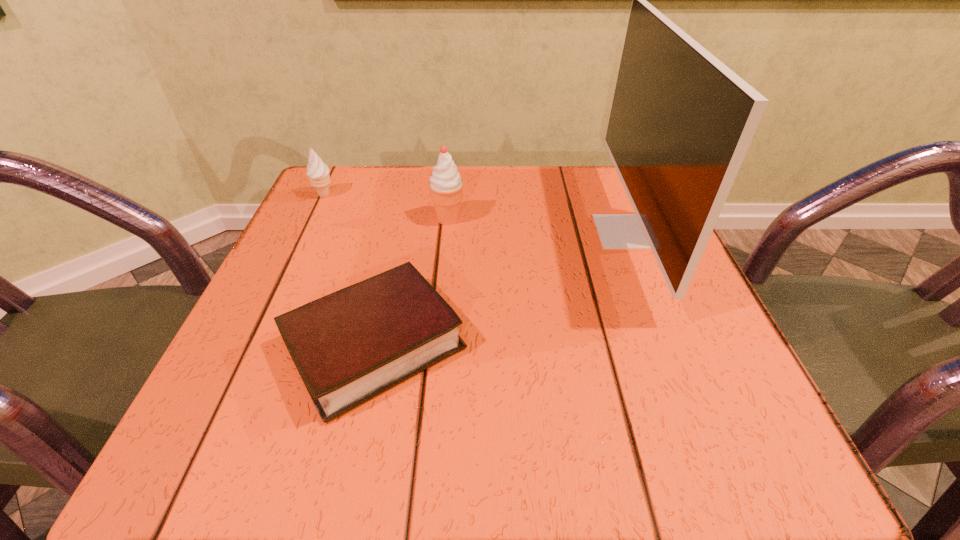
This screenshot has height=540, width=960. What are the coordinates of `vacant space that satisfies the following two spatial constraints: 1. on the front-facing side of the nearer icecream; 2. on the right side of the shorter icecream` in the screenshot? It's located at (314, 219).

The image size is (960, 540). Identify the location of vacant position in the image that satisfies the following two spatial constraints: 1. on the front-facing side of the shorter icecream; 2. on the right side of the shortest object. (254, 345).